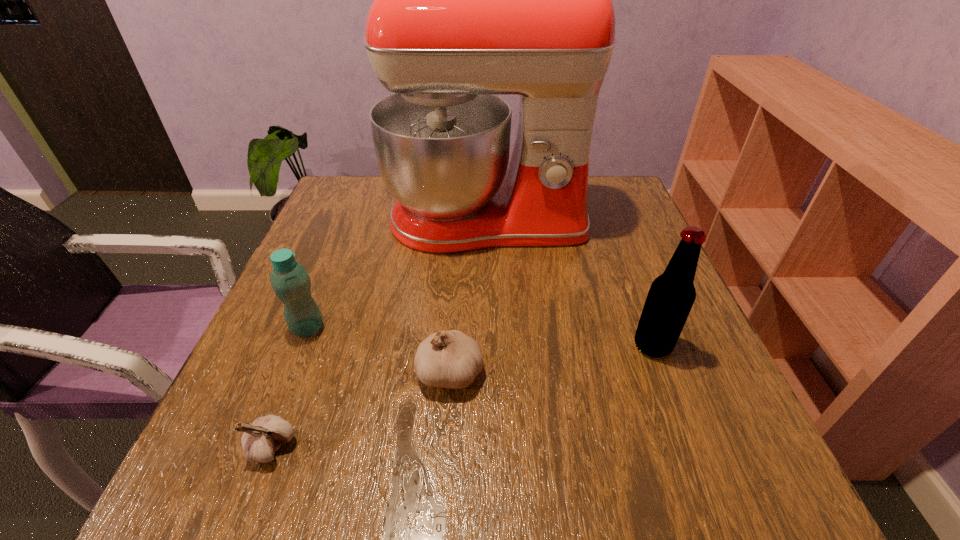
Where is `vacant space that's between the rightmost object and the right garlic`? vacant space that's between the rightmost object and the right garlic is located at coordinates (551, 359).

At what (x,y) coordinates should I click in order to perform the action: click on vacant area between the rightmost object and the farthest object. Please return your answer as a coordinate pair (x, y). This screenshot has height=540, width=960. Looking at the image, I should click on (569, 284).

I want to click on free space between the water bottle and the shortest object, so click(x=290, y=387).

Find the location of a particular element. The width and height of the screenshot is (960, 540). vacant point located between the mixer and the third shortest object is located at coordinates (397, 275).

The image size is (960, 540). Identify the location of free space between the beer bottle and the third tallest object. (480, 337).

Where is `free space between the nearest object and the beer bottle`? The width and height of the screenshot is (960, 540). free space between the nearest object and the beer bottle is located at coordinates (463, 396).

Select which object is the closest to the water bottle. Please provide its 2D coordinates. Your answer should be formatted as a tuple, i.e. [(x, y)], where the tuple contains the x and y coordinates of a point satisfying the conditions above.

[(260, 440)]

Locate an element on the screen. object that is the third closest to the farthest object is located at coordinates (450, 359).

Find the location of a particular element. The image size is (960, 540). free region that satisfies the following two spatial constraints: 1. on the front-facing side of the fourth shortest object; 2. on the right side of the tallest object is located at coordinates (490, 346).

You are a GUI agent. You are given a task and a screenshot of the screen. Output one action in this format:
    pyautogui.click(x=<x>, y=<y>)
    Task: Click on the free space that satisfies the following two spatial constraints: 1. on the back side of the beer bottle; 2. at the front cap of the water bottle
    
    Given the screenshot: What is the action you would take?
    (645, 328)